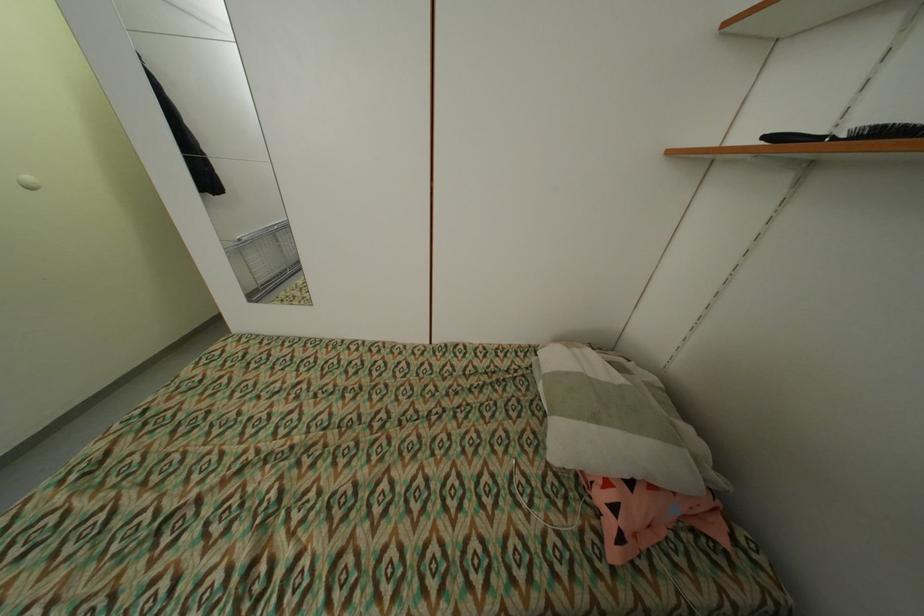
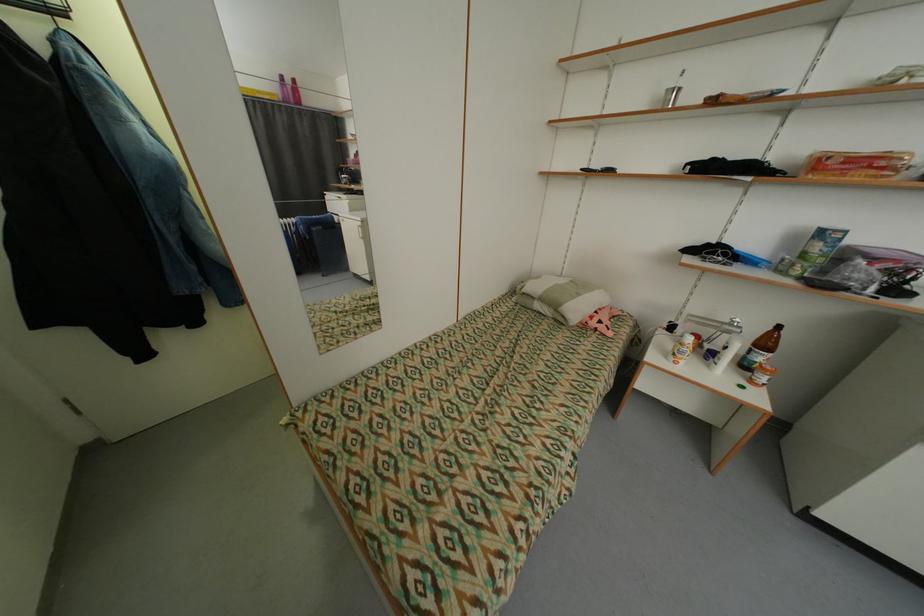
Find the pixel in the second image that matches (602,421) in the first image.

(585, 296)